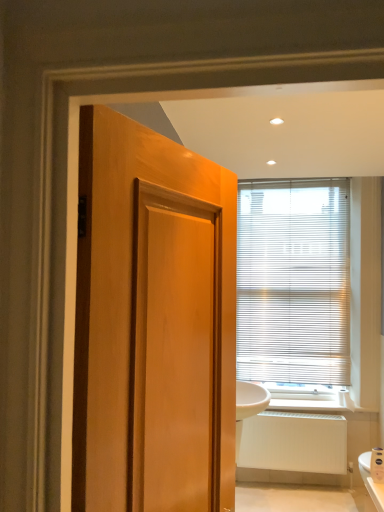
Question: Does white textured blinds at upper center touch white matte radiator at lower right?

Choices:
 (A) no
 (B) yes

Answer: (A)

Question: Is white textured blinds at upper center shorter than white matte radiator at lower right?

Choices:
 (A) yes
 (B) no

Answer: (B)

Question: Is white textured blinds at upper center positioned behind white matte radiator at lower right?

Choices:
 (A) yes
 (B) no

Answer: (A)

Question: Can you confirm if white textured blinds at upper center is taller than white matte radiator at lower right?

Choices:
 (A) no
 (B) yes

Answer: (B)

Question: From a real-world perspective, does white textured blinds at upper center stand above white matte radiator at lower right?

Choices:
 (A) no
 (B) yes

Answer: (B)

Question: Does white textured blinds at upper center have a larger size compared to white matte radiator at lower right?

Choices:
 (A) yes
 (B) no

Answer: (A)

Question: Considering the relative sizes of white matte radiator at lower right and white textured blinds at upper center in the image provided, is white matte radiator at lower right wider than white textured blinds at upper center?

Choices:
 (A) no
 (B) yes

Answer: (B)

Question: Is white matte radiator at lower right positioned in front of white textured blinds at upper center?

Choices:
 (A) no
 (B) yes

Answer: (B)

Question: Considering the relative sizes of white matte radiator at lower right and white textured blinds at upper center in the image provided, is white matte radiator at lower right bigger than white textured blinds at upper center?

Choices:
 (A) no
 (B) yes

Answer: (A)

Question: Is white matte radiator at lower right placed right next to white textured blinds at upper center?

Choices:
 (A) no
 (B) yes

Answer: (A)

Question: Does white matte radiator at lower right have a greater height compared to white textured blinds at upper center?

Choices:
 (A) yes
 (B) no

Answer: (B)

Question: Would you say white matte radiator at lower right is outside white textured blinds at upper center?

Choices:
 (A) no
 (B) yes

Answer: (B)

Question: Considering the positions of point (273, 297) and point (319, 443), is point (273, 297) closer or farther from the camera than point (319, 443)?

Choices:
 (A) closer
 (B) farther

Answer: (B)